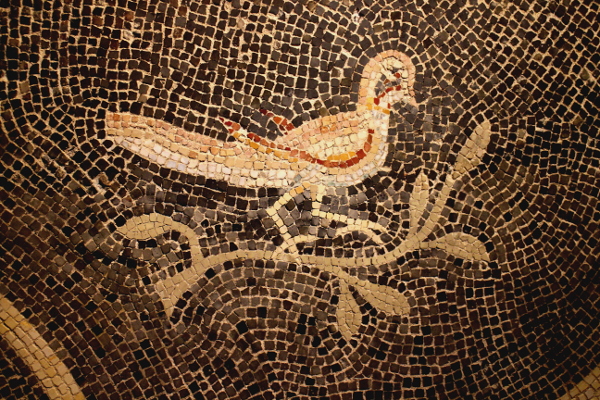
The height and width of the screenshot is (400, 600). I want to click on light grey tile, so click(x=253, y=212).